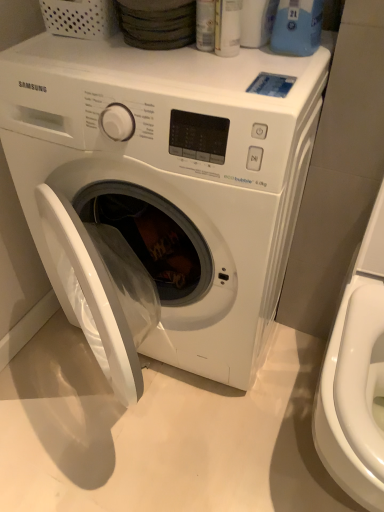
In order to click on free space to the left of blue plastic bottle at upper right in this screenshot , I will do `click(219, 59)`.